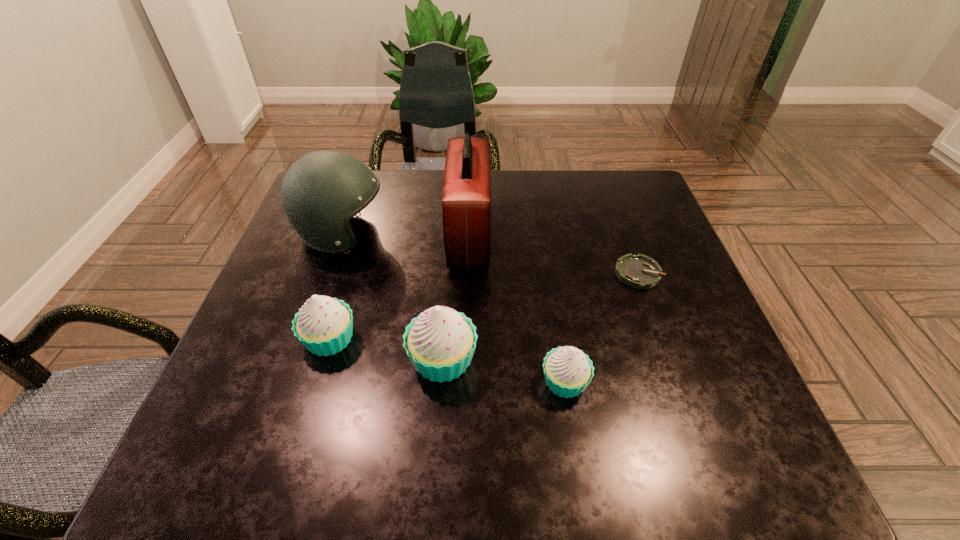
What are the coordinates of `the second tallest cupcake` in the screenshot? It's located at (324, 325).

Locate an element on the screen. The height and width of the screenshot is (540, 960). the third shortest object is located at coordinates (324, 325).

Find the location of a particular element. the tallest cupcake is located at coordinates (440, 343).

Image resolution: width=960 pixels, height=540 pixels. What are the coordinates of `the second cupcake from left to right` in the screenshot? It's located at (440, 343).

Where is `the rightmost cupcake`? Image resolution: width=960 pixels, height=540 pixels. the rightmost cupcake is located at coordinates (568, 371).

Locate an element on the screen. the shortest cupcake is located at coordinates (568, 371).

Where is `the first aid kit`? the first aid kit is located at coordinates (466, 201).

I want to click on the rightmost object, so click(x=639, y=271).

At what (x,y) coordinates should I click in order to perform the action: click on the shortest object. Please return your answer as a coordinate pair (x, y). Looking at the image, I should click on (639, 271).

Locate an element on the screen. This screenshot has height=540, width=960. football helmet is located at coordinates (320, 193).